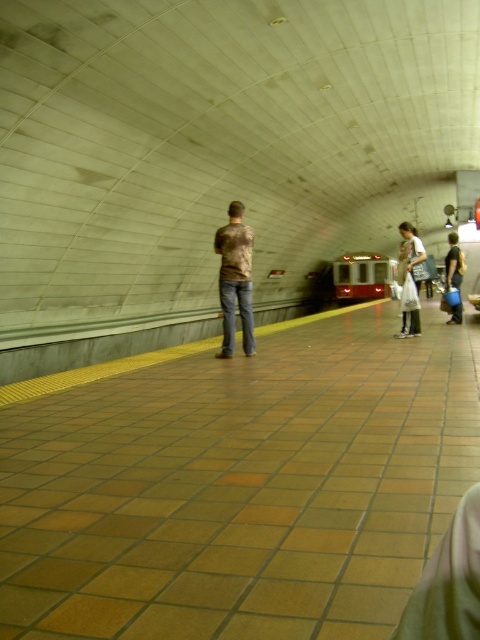
You are a fashion designer observing people at a subway station. You notice a person wearing a white cotton shirt at center and another wearing denim pants at right. Which clothing item has a narrower width?

The white cotton shirt at center has a narrower width than the denim pants at right.

You are observing a subway platform scene. There are two people at the center wearing shirts. One is wearing a brown textured shirt at center and the other a white cotton shirt at center. Which shirt is taller?

The brown textured shirt at center is taller than the white cotton shirt at center.